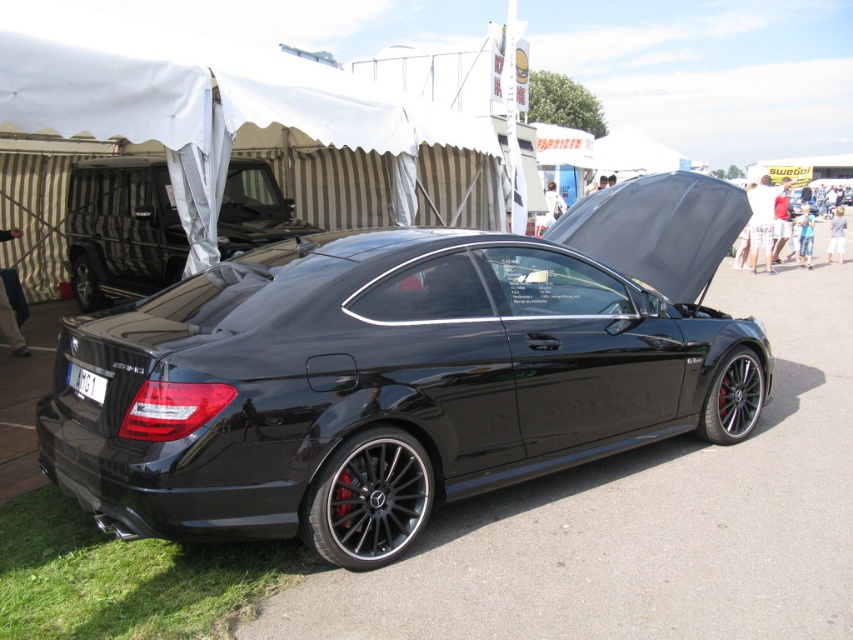
Can you confirm if green grass at lower left is positioned above black plastic license plate at rear?

No, green grass at lower left is not above black plastic license plate at rear.

The height and width of the screenshot is (640, 853). I want to click on green grass at lower left, so click(123, 579).

Does green grass at lower left have a lesser height compared to black matte truck at upper left?

Yes, green grass at lower left is shorter than black matte truck at upper left.

Measure the distance between green grass at lower left and camera.

2.84 meters

Find the location of a particular element. The width and height of the screenshot is (853, 640). green grass at lower left is located at coordinates (123, 579).

Is glossy black car at center to the right of green grass at lower left from the viewer's perspective?

Yes, glossy black car at center is to the right of green grass at lower left.

Who is higher up, glossy black car at center or green grass at lower left?

glossy black car at center is above.

Measure the distance between point (683, 413) and camera.

Point (683, 413) and camera are 4.92 meters apart from each other.

Where is `glossy black car at center`? The width and height of the screenshot is (853, 640). glossy black car at center is located at coordinates (404, 372).